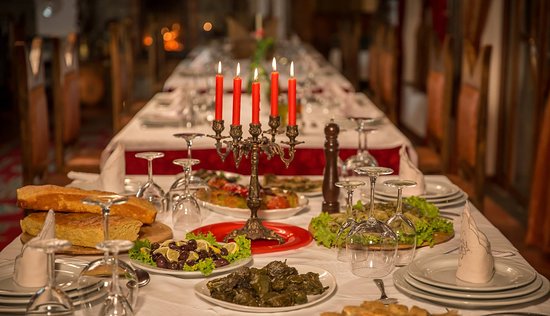
Locate an element on the screen. The image size is (550, 316). glass is located at coordinates (184, 207).